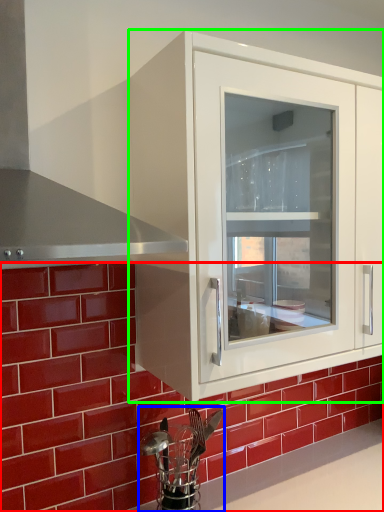
Question: Considering the real-world distances, which object is closest to brick (highlighted by a red box)? appliance (highlighted by a blue box) or cabinetry (highlighted by a green box).

Choices:
 (A) appliance
 (B) cabinetry

Answer: (A)